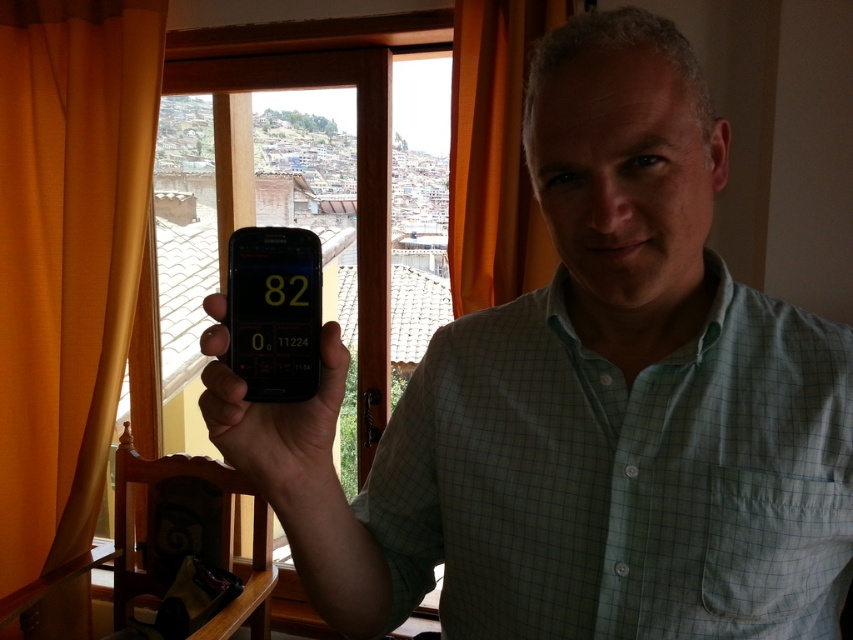
Does matte black phone at center have a greater width compared to black matte phone at center?

No.

Who is more forward, (305, 385) or (296, 520)?

Point (305, 385) is more forward.

At what (x,y) coordinates should I click in order to perform the action: click on matte black phone at center. Please return your answer as a coordinate pair (x, y). This screenshot has height=640, width=853. Looking at the image, I should click on (274, 310).

Who is lower down, orange fabric curtain at left or black matte phone at center?

black matte phone at center

Does orange fabric curtain at left appear under black matte phone at center?

Actually, orange fabric curtain at left is above black matte phone at center.

Is point (86, 224) positioned after point (292, 483)?

Yes, point (86, 224) is behind point (292, 483).

Where is `orange fabric curtain at left`? The height and width of the screenshot is (640, 853). orange fabric curtain at left is located at coordinates (67, 257).

Based on the photo, is green checkered shirt at center further to camera compared to matte black phone at center?

Yes, it is.

Can you confirm if green checkered shirt at center is bigger than matte black phone at center?

Correct, green checkered shirt at center is larger in size than matte black phone at center.

Find the location of a particular element. The image size is (853, 640). green checkered shirt at center is located at coordinates (622, 477).

Image resolution: width=853 pixels, height=640 pixels. I want to click on green checkered shirt at center, so click(622, 477).